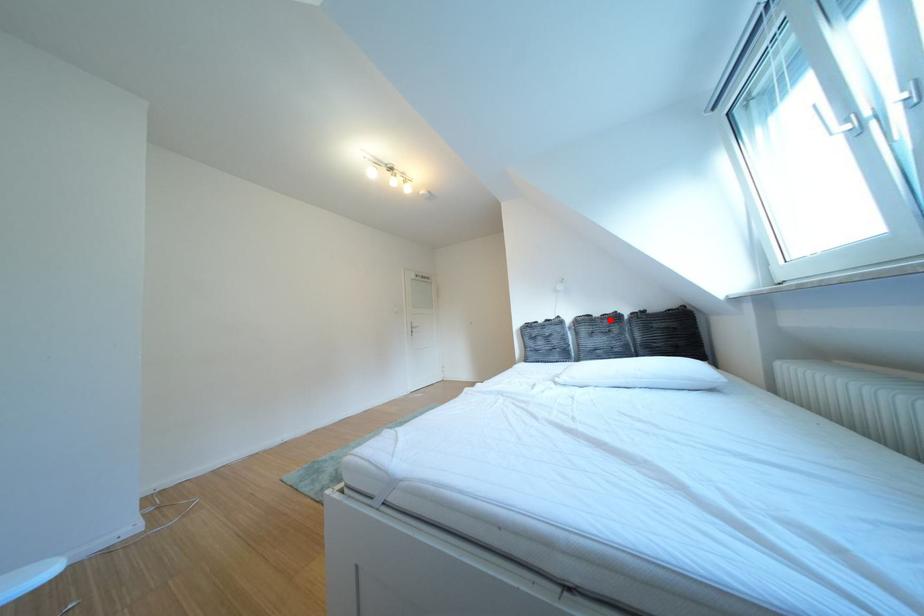
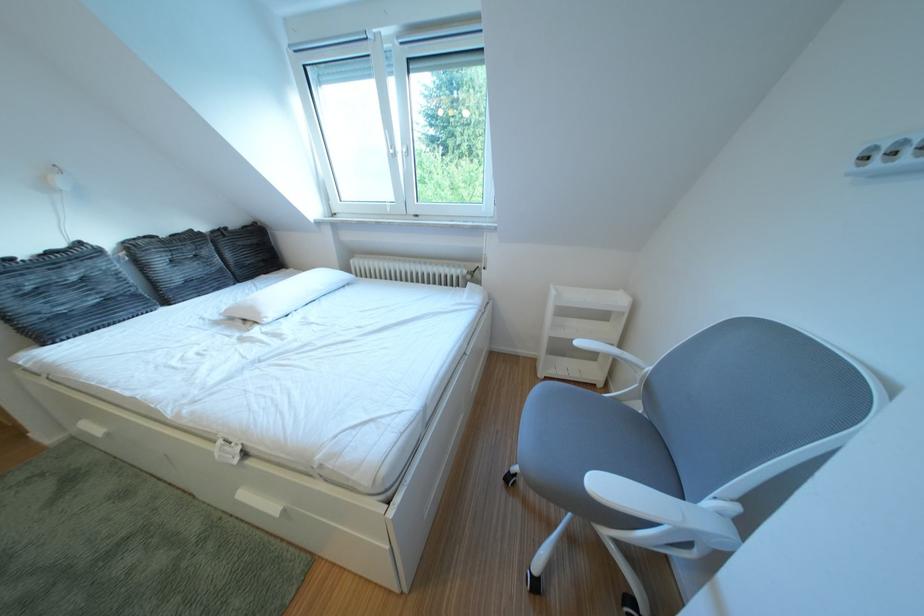
Locate, in the second image, the point that corresponds to the highlighted location in the first image.

(176, 240)